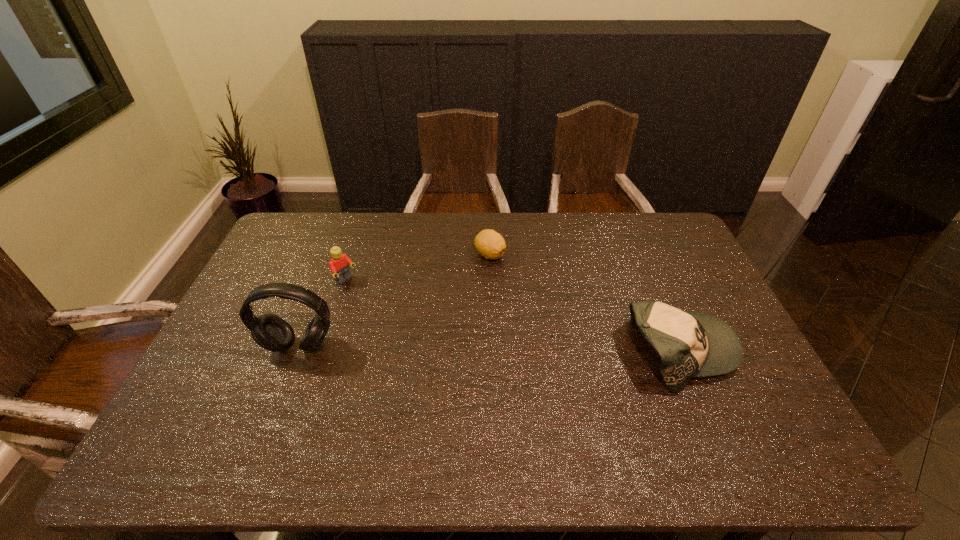
In the image, there is a desktop. Identify the location of vacant space at the far left corner. The width and height of the screenshot is (960, 540). (274, 242).

Locate an element on the screen. This screenshot has height=540, width=960. vacant space at the far right corner is located at coordinates (655, 220).

Identify the location of vacant region at the near right corner of the desktop. (732, 406).

What are the coordinates of `vacant space that's between the third object from left to right and the tallest object` in the screenshot? It's located at (395, 300).

Image resolution: width=960 pixels, height=540 pixels. Find the location of `free spot between the baseball cap and the Lego`. free spot between the baseball cap and the Lego is located at coordinates (514, 316).

Find the location of a particular element. This screenshot has width=960, height=540. empty space between the farthest object and the Lego is located at coordinates (418, 268).

What are the coordinates of `vacant region between the third nearest object and the rightmost object` in the screenshot? It's located at (514, 316).

This screenshot has height=540, width=960. Find the location of `free point between the lemon and the rightmost object`. free point between the lemon and the rightmost object is located at coordinates (586, 303).

You are a GUI agent. You are given a task and a screenshot of the screen. Output one action in this format:
    pyautogui.click(x=<x>, y=<y>)
    Task: Click on the vacant space that is in between the tallest object and the lemon
    
    Given the screenshot: What is the action you would take?
    pyautogui.click(x=395, y=300)

Locate an element on the screen. free space between the farthest object and the tallest object is located at coordinates (395, 300).